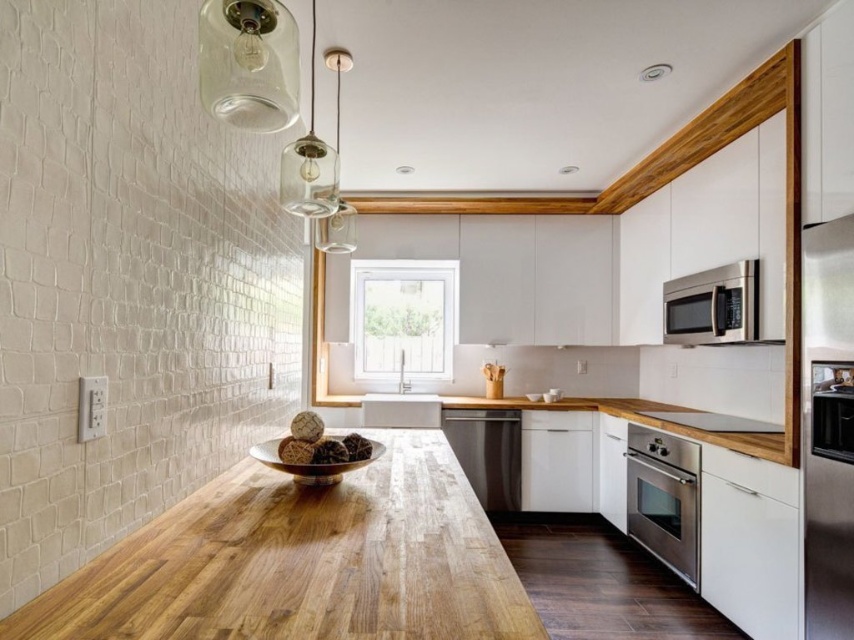
You are standing in the modern kitchen and want to place a small plant between the two points, point (627, 435) and point (671, 298). Which point should you position the plant closer to in order to make it appear larger in your view?

You should position the plant closer to point (627, 435) because it is closer to the camera, making the plant appear larger in your view.

You are a kitchen designer planning to install a new appliance. You have a space that can accommodate the size of the satin stainless steel dishwasher at center. Can the stainless steel oven at lower right fit in that space?

The stainless steel oven at lower right is bigger than the satin stainless steel dishwasher at center, so it cannot fit in the space designated for the dishwasher.

You are a kitchen designer planning to install a new appliance. You have a space that can only accommodate appliances with a thickness of 15 cm. You see the stainless steel oven at lower right and the satin silver microwave at upper right in the current setup. Which appliance would be suitable for the space?

The stainless steel oven at lower right is thinner than the satin silver microwave at upper right, so it would be suitable for the space with a 15 cm thickness requirement.